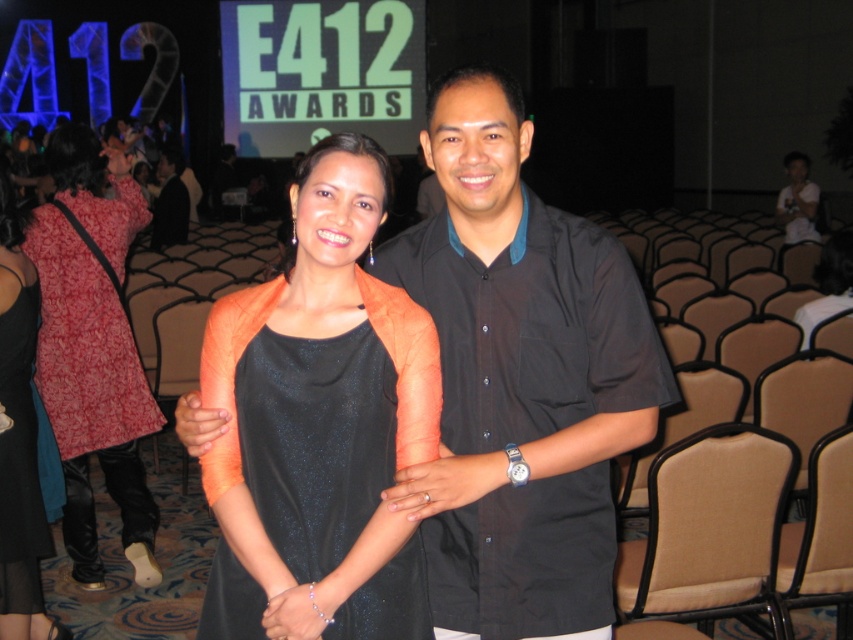
What do you see at coordinates (711, 529) in the screenshot?
I see `beige fabric chair at lower right` at bounding box center [711, 529].

Identify the location of beige fabric chair at lower right. The image size is (853, 640). (711, 529).

Image resolution: width=853 pixels, height=640 pixels. I want to click on beige fabric chair at lower right, so click(x=711, y=529).

Is black satin dress at left further to camera compared to dark gray suit at left?

No, it is in front of dark gray suit at left.

Which is behind, point (10, 608) or point (180, 204)?

Point (180, 204)

Image resolution: width=853 pixels, height=640 pixels. I want to click on black satin dress at left, so click(20, 461).

Does black matte shirt at center have a greater height compared to beige fabric chair at lower right?

Correct, black matte shirt at center is much taller as beige fabric chair at lower right.

From the picture: Does black matte shirt at center lie behind beige fabric chair at lower right?

No, it is in front of beige fabric chair at lower right.

Between point (573, 440) and point (682, 502), which one is positioned behind?

Positioned behind is point (682, 502).

You are a GUI agent. You are given a task and a screenshot of the screen. Output one action in this format:
    pyautogui.click(x=<x>, y=<y>)
    Task: Click on the black matte shirt at center
    The image size is (853, 640).
    Given the screenshot: What is the action you would take?
    pyautogui.click(x=520, y=380)